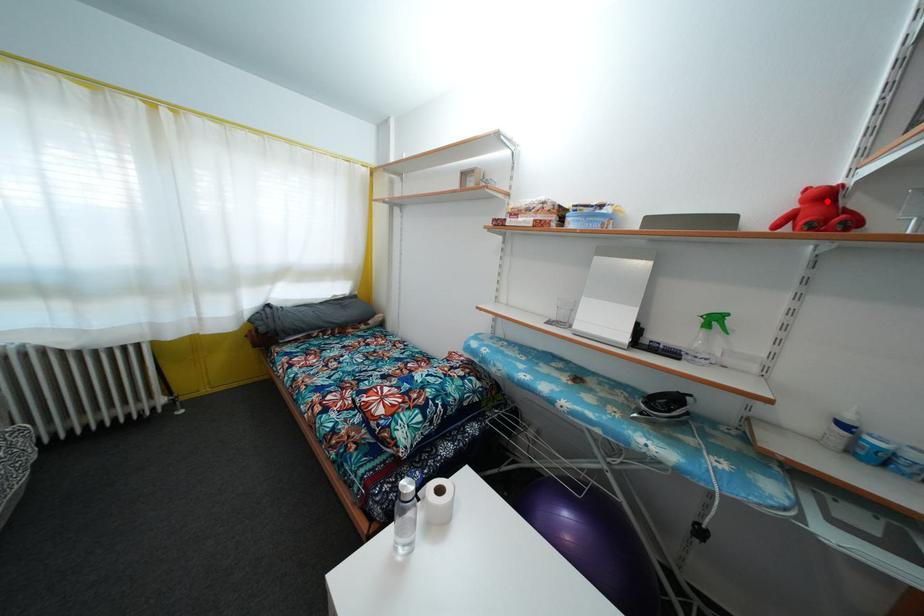
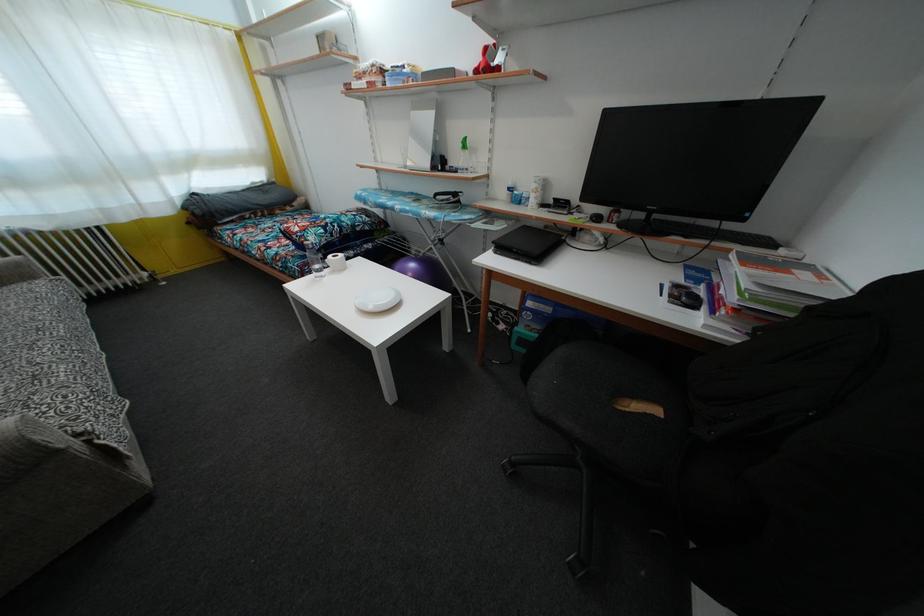
Question: I am providing you with two images of the same scene from different viewpoints. Given a red point in image1, look at the same physical point in image2. Is it:

Choices:
 (A) Closer to the viewpoint
 (B) Farther from the viewpoint

Answer: (A)